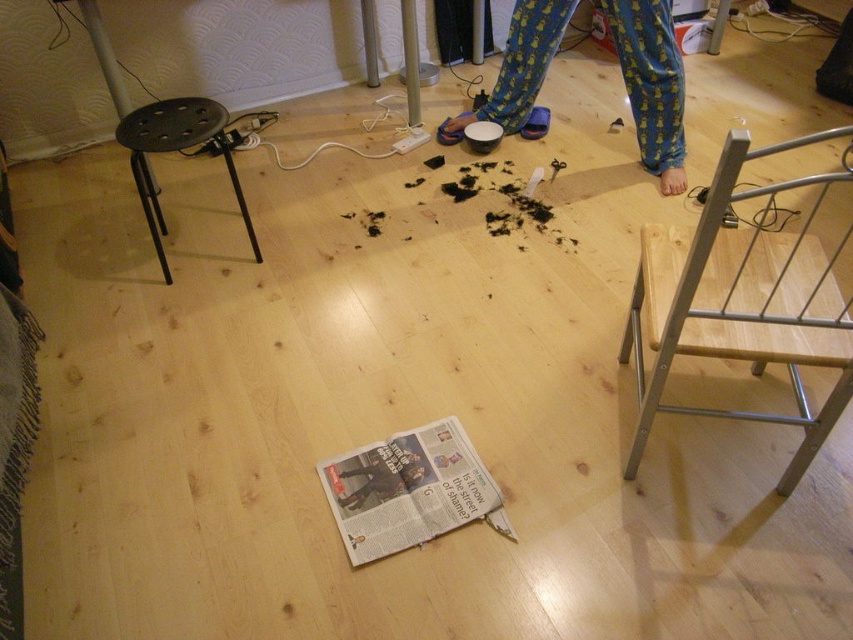
You are standing in the room and see the white glossy newspaper at center and the dark gray fabric pants at center. Which object is closer to the floor?

The white glossy newspaper at center is closer to the floor because it is below the dark gray fabric pants at center.

Based on the photo, you are a delivery person who needs to place a package between the black plastic stool at left and the dark gray fabric pants at center. The package is 0.5 meters long. Is there enough space between them to fit the package?

The distance between the black plastic stool at left and the dark gray fabric pants at center is 1.04 meters. Since the package is 0.5 meters long, there is enough space to fit it between them.